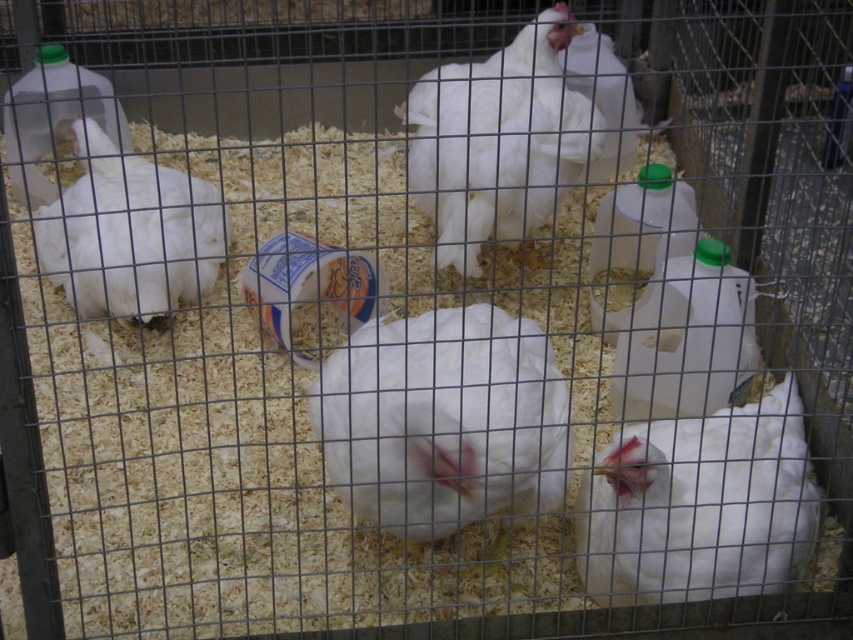
Consider the image. You are a farmer checking the chickens in their cage. You notice a specific point at coordinates (444, 420). What object is this point located on?

The point at (444, 420) is located on the white matte chicken at center.

You are a farmer checking the chicken coop. You see the white feathered chicken at center and the green plastic bottle at right. Which object is closer to the left side of the coop?

The white feathered chicken at center is positioned on the left side of the green plastic bottle at right, so it is closer to the left side of the coop.